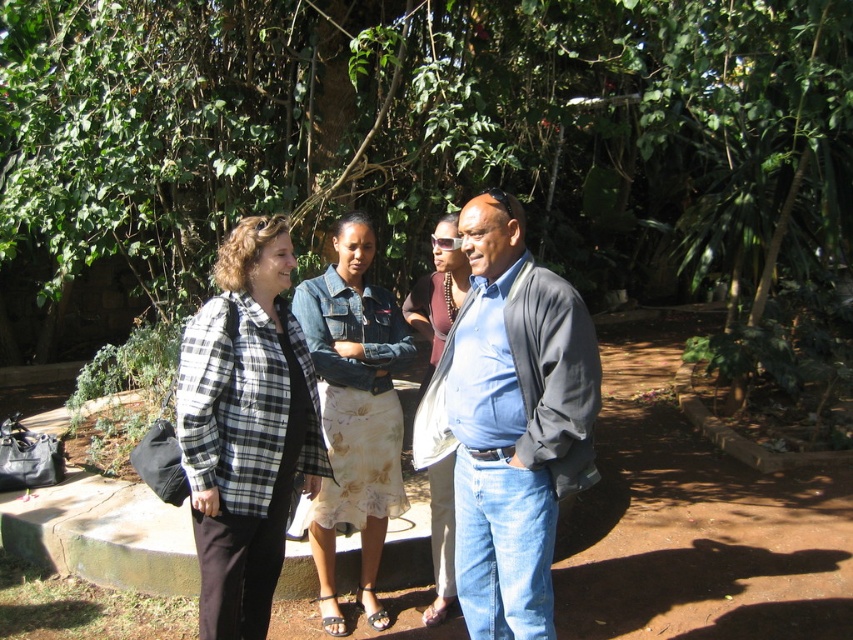
Question: Can you confirm if green leafy tree at center is thinner than denim jacket at center?

Choices:
 (A) no
 (B) yes

Answer: (A)

Question: Which point is farther to the camera?

Choices:
 (A) denim skirt at center
 (B) denim jeans at center

Answer: (A)

Question: Which object appears farthest from the camera in this image?

Choices:
 (A) denim skirt at center
 (B) plaid shirt at left
 (C) denim jeans at center
 (D) denim jacket at center

Answer: (A)

Question: Is denim jeans at center to the left of plaid shirt at left from the viewer's perspective?

Choices:
 (A) yes
 (B) no

Answer: (B)

Question: Where is denim jacket at center located in relation to denim skirt at center in the image?

Choices:
 (A) right
 (B) left

Answer: (B)

Question: Which object is the farthest from the denim jacket at center?

Choices:
 (A) denim jeans at center
 (B) green leafy tree at center

Answer: (B)